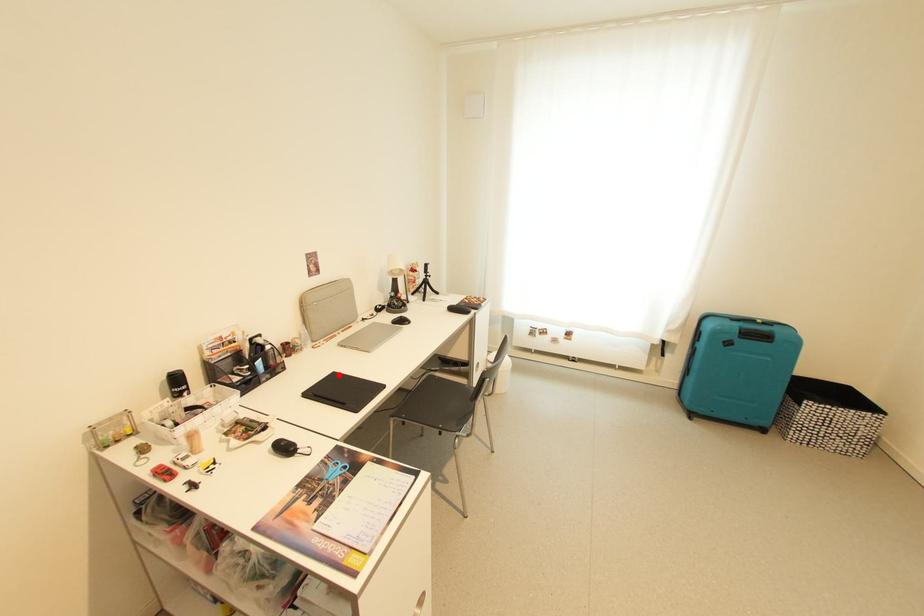
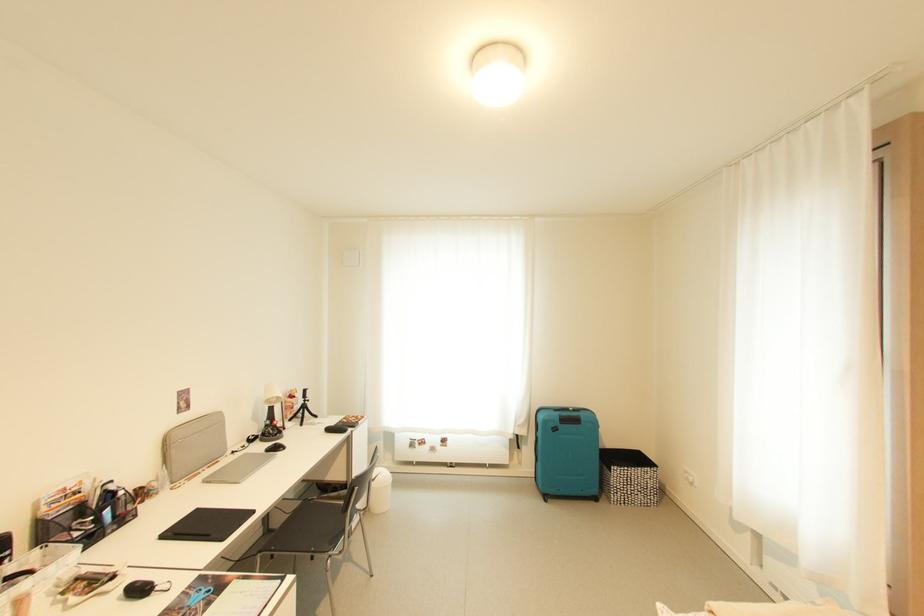
Where in the second image is the point corresponding to the highlighted location from the first image?

(202, 512)